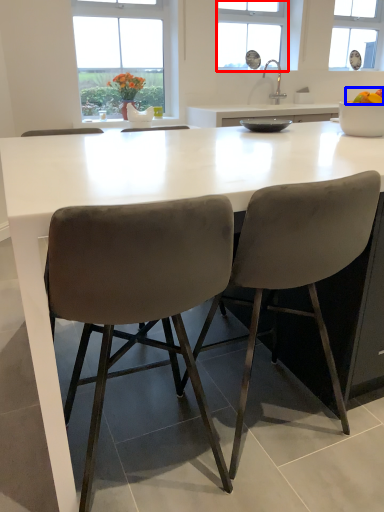
Question: Which object appears closest to the camera in this image, window (highlighted by a red box) or food (highlighted by a blue box)?

Choices:
 (A) window
 (B) food

Answer: (B)